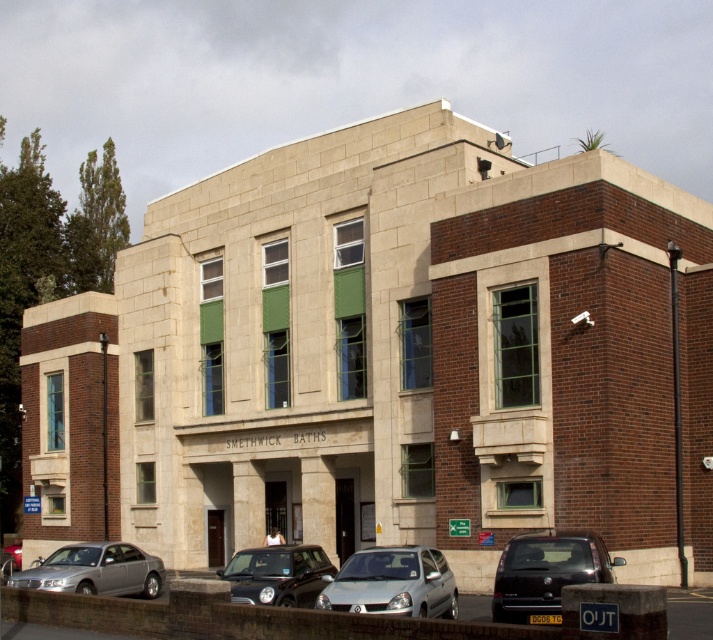
You are standing in front of the building and want to locate two specific points marked on the facade. The first point is at coordinate point (x=528, y=568) and the second is at point (x=332, y=570). Which of these points is closer to your current position?

Point (x=528, y=568) is closer to the viewer than point (x=332, y=570).

You are a pedestrian standing in front of the two story building labeled SMETHWICK BATHS. You see a dark gray metallic van at lower right and a silver metallic hatchback at center. Which vehicle is closer to you?

The dark gray metallic van at lower right is closer to you because it is in front of the silver metallic hatchback at center.

From the picture: You are a delivery driver who needs to park your vehicle in the parking area in front of the two story building labeled SMETHWICK BATHS. You see a dark gray metallic van at lower right and a silver metallic sedan at lower left. Which vehicle takes up less space in the parking spot?

The dark gray metallic van at lower right is smaller than the silver metallic sedan at lower left, so it takes up less space in the parking spot.